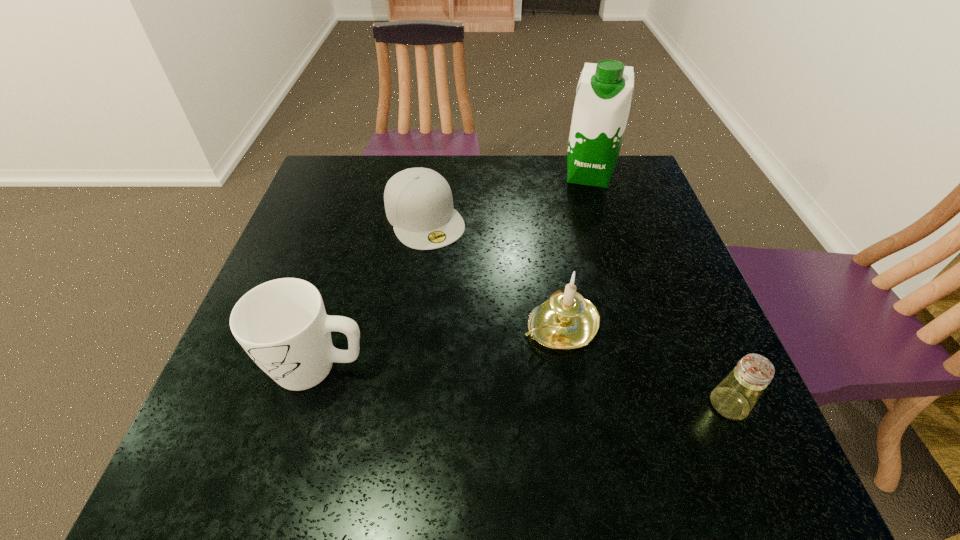
Where is `free space on the desktop that is between the mug and the rightmost object and is positioned on the handle side of the candle holder`? Image resolution: width=960 pixels, height=540 pixels. free space on the desktop that is between the mug and the rightmost object and is positioned on the handle side of the candle holder is located at coordinates (473, 381).

You are a GUI agent. You are given a task and a screenshot of the screen. Output one action in this format:
    pyautogui.click(x=<x>, y=<y>)
    Task: Click on the free spot on the desktop that is between the mug and the saltshaker and is positioned on the front-facing side of the shortest object
    This screenshot has height=540, width=960.
    Given the screenshot: What is the action you would take?
    pyautogui.click(x=532, y=387)

Identify the location of vacant space on the desktop that is between the mug and the saltshaker and is positioned on the front-facing side of the soya milk. The height and width of the screenshot is (540, 960). (562, 389).